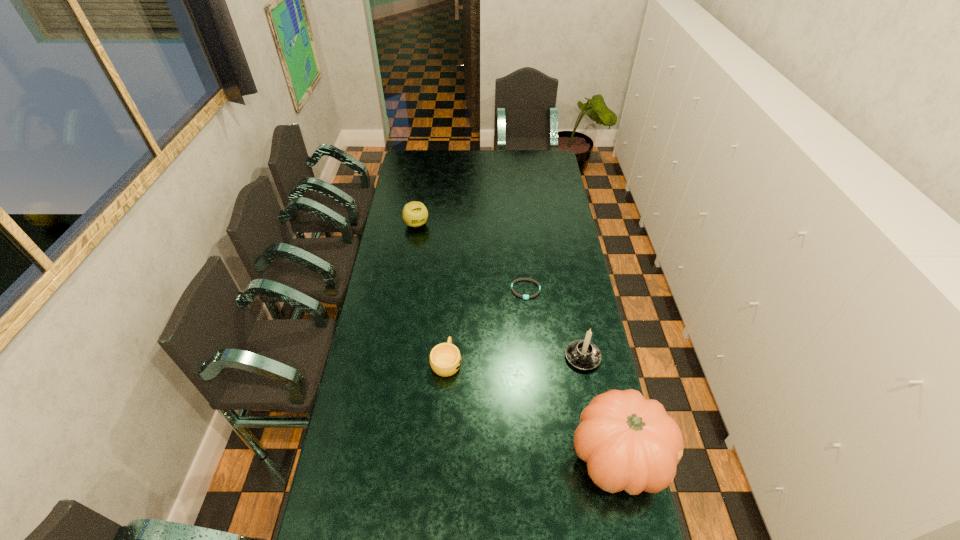
Find the location of `free space between the third object from left to right and the candle holder`. free space between the third object from left to right and the candle holder is located at coordinates (554, 323).

Locate an element on the screen. This screenshot has height=540, width=960. vacant space in between the wristband and the fourth object from right to left is located at coordinates (486, 326).

Where is `free space between the shortest object and the second object from left to right`? This screenshot has height=540, width=960. free space between the shortest object and the second object from left to right is located at coordinates [486, 326].

Find the location of a particular element. The width and height of the screenshot is (960, 540). free spot between the second object from left to right and the leftmost object is located at coordinates (431, 293).

Identify the location of free space between the wristband and the farthest object. (471, 257).

This screenshot has height=540, width=960. Identify the location of vacant area that lies between the second object from left to right and the pumpkin. (532, 409).

Find the location of `vacant area that lies between the cup and the tallest object`. vacant area that lies between the cup and the tallest object is located at coordinates (532, 409).

Choose which object is the nearest neighbor to the second tallest object. Please provide its 2D coordinates. Your answer should be formatted as a tuple, i.e. [(x, y)], where the tuple contains the x and y coordinates of a point satisfying the conditions above.

[(630, 443)]

Locate which object is the fourth closest to the second object from left to right. Please provide its 2D coordinates. Your answer should be formatted as a tuple, i.e. [(x, y)], where the tuple contains the x and y coordinates of a point satisfying the conditions above.

[(415, 214)]

Image resolution: width=960 pixels, height=540 pixels. I want to click on vacant area in the image that satisfies the following two spatial constraints: 1. on the front side of the fourth shortest object; 2. on the left side of the third object from left to right, so [x=532, y=357].